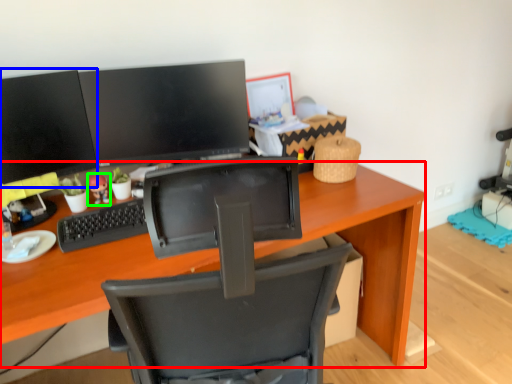
Question: Based on their relative distances, which object is nearer to desk (highlighted by a red box)? Choose from computer monitor (highlighted by a blue box) and toy (highlighted by a green box).

Choices:
 (A) computer monitor
 (B) toy

Answer: (A)